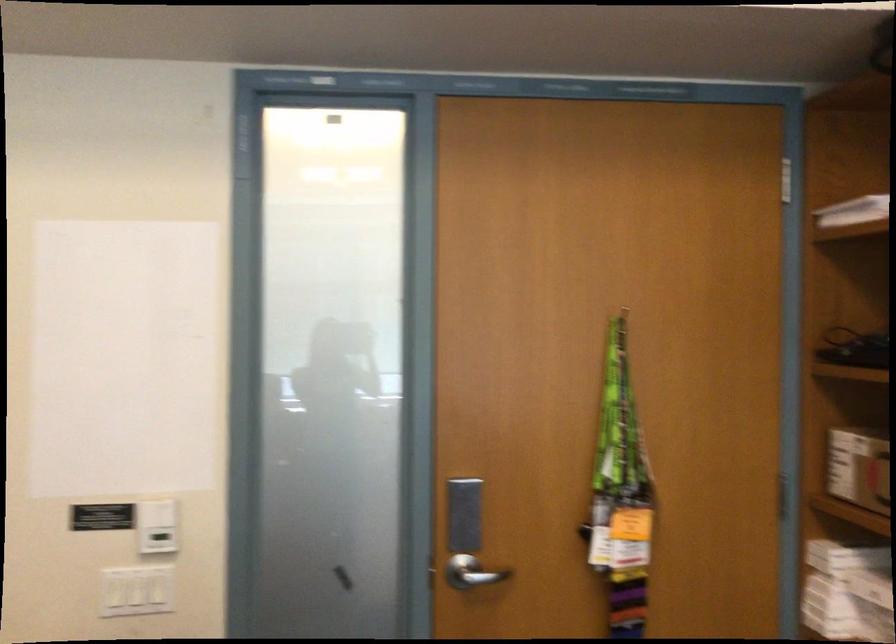
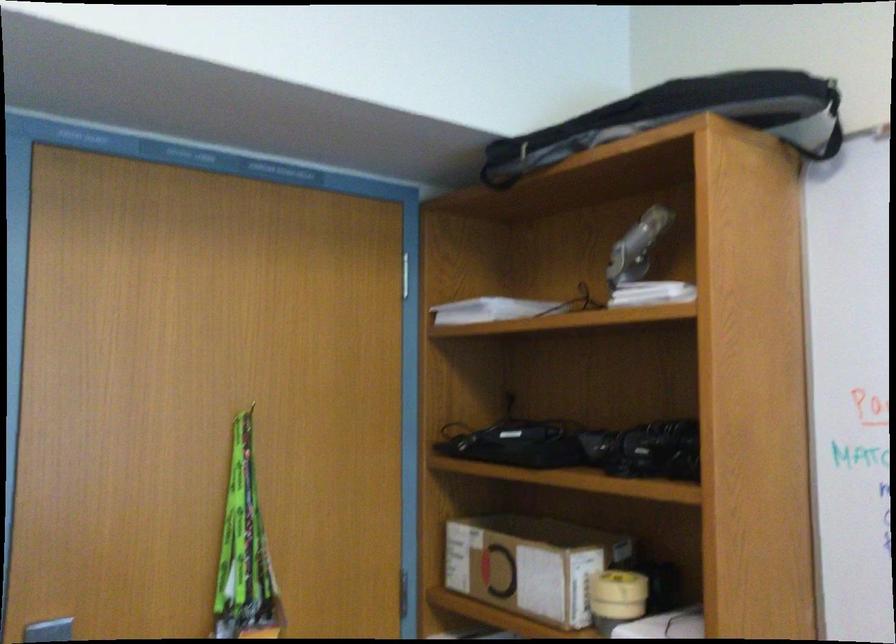
What movement of the cameraman would produce the second image?

The cameraman walked toward left, forward.